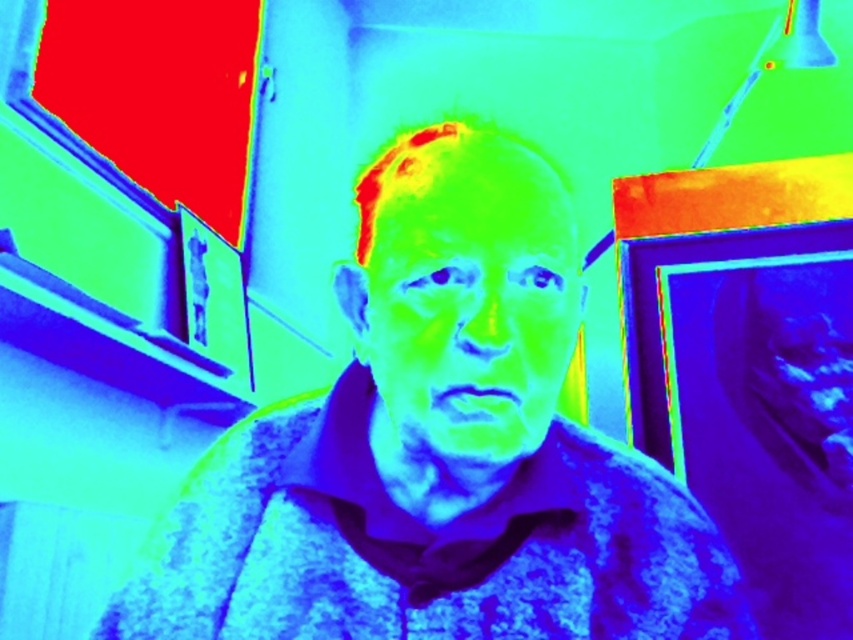
Does fluffy fabric man at center have a greater height compared to matte skin face at center?

Yes.

Is fluffy fabric man at center wider than matte skin face at center?

Yes.

Does point (437, 195) come closer to viewer compared to point (527, 212)?

No, it is not.

Identify the location of fluffy fabric man at center. (438, 449).